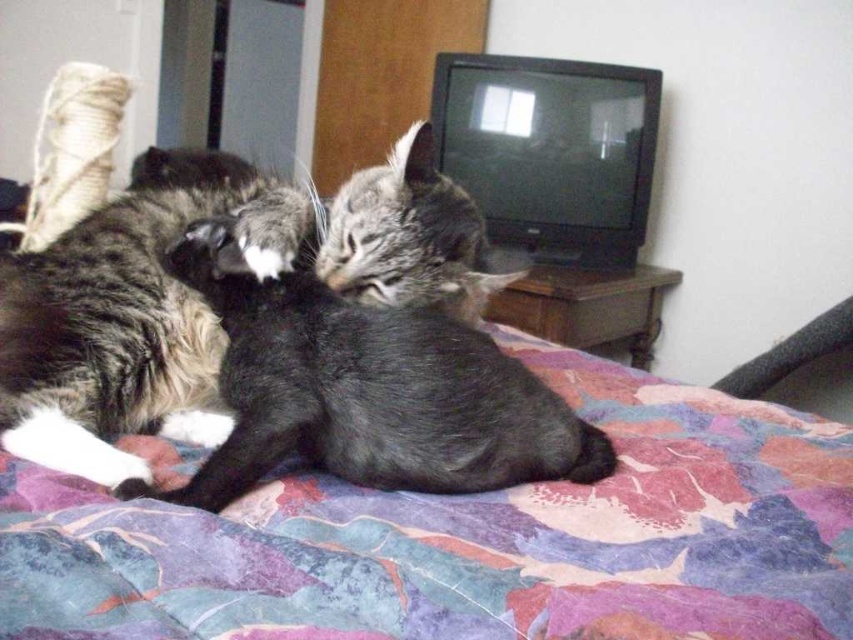
Is floral fabric bedcover at center to the right of soft gray fur cat at center from the viewer's perspective?

Yes, floral fabric bedcover at center is to the right of soft gray fur cat at center.

Which is above, floral fabric bedcover at center or soft gray fur cat at center?

Positioned higher is soft gray fur cat at center.

Is point (195, 616) in front of point (305, 445)?

Yes, it is in front of point (305, 445).

The width and height of the screenshot is (853, 640). In order to click on floral fabric bedcover at center in this screenshot , I will do `click(469, 538)`.

Is floral fabric bedcover at center to the right of tabby fur cat at center from the viewer's perspective?

Yes, floral fabric bedcover at center is to the right of tabby fur cat at center.

Can you confirm if floral fabric bedcover at center is thinner than tabby fur cat at center?

No, floral fabric bedcover at center is not thinner than tabby fur cat at center.

Who is more distant from viewer, (720, 589) or (215, 412)?

Positioned behind is point (215, 412).

Locate an element on the screen. This screenshot has height=640, width=853. floral fabric bedcover at center is located at coordinates (469, 538).

Does soft gray fur cat at center have a larger size compared to tabby fur cat at center?

Incorrect, soft gray fur cat at center is not larger than tabby fur cat at center.

Based on the photo, does soft gray fur cat at center have a lesser height compared to tabby fur cat at center?

Indeed, soft gray fur cat at center has a lesser height compared to tabby fur cat at center.

Which is in front, point (468, 440) or point (201, 362)?

Point (468, 440) is more forward.

Locate an element on the screen. soft gray fur cat at center is located at coordinates (366, 392).